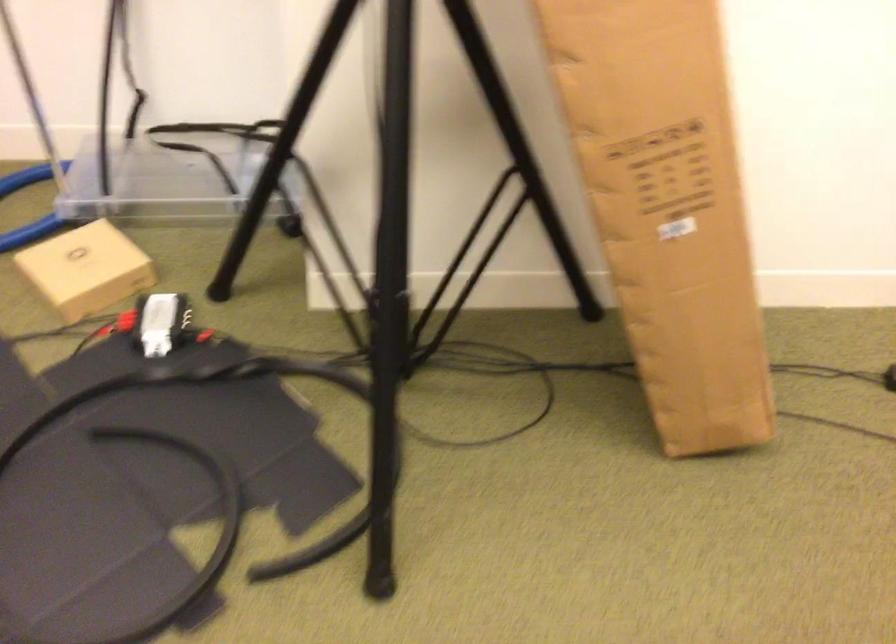
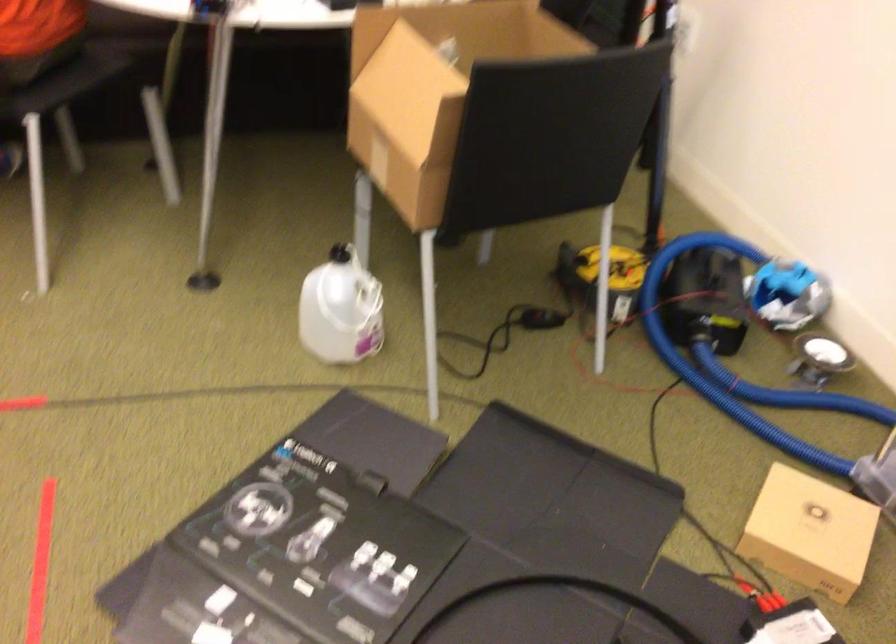
Question: The images are taken continuously from a first-person perspective. In which direction is your viewpoint rotating?

Choices:
 (A) Left
 (B) Right
 (C) Up
 (D) Down

Answer: (A)